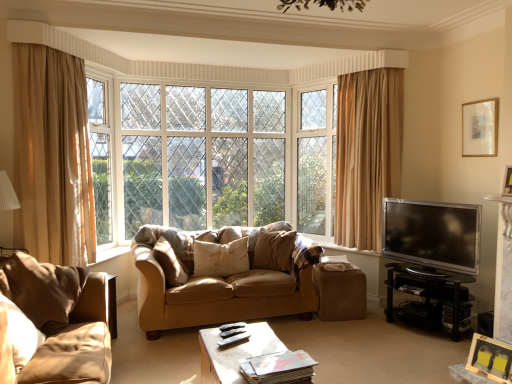
Question: Considering the relative positions of beige fabric pillow at center, the 2th pillow viewed from the left, and suede-like beige pillow at center, which appears as the 3th pillow when viewed from the right, in the image provided, is beige fabric pillow at center, the 2th pillow viewed from the left, in front of suede-like beige pillow at center, which appears as the 3th pillow when viewed from the right,?

Choices:
 (A) no
 (B) yes

Answer: (A)

Question: Does beige fabric pillow at center, the 2th pillow viewed from the left, have a lesser height compared to suede-like beige pillow at center, which appears as the 3th pillow when viewed from the right?

Choices:
 (A) yes
 (B) no

Answer: (A)

Question: Can you confirm if beige fabric pillow at center, the 2th pillow viewed from the left, is smaller than suede-like beige pillow at center, the first pillow viewed from the left?

Choices:
 (A) no
 (B) yes

Answer: (B)

Question: From a real-world perspective, is beige fabric pillow at center, the 2th pillow viewed from the left, on top of suede-like beige pillow at center, the first pillow viewed from the left?

Choices:
 (A) no
 (B) yes

Answer: (A)

Question: Is beige fabric pillow at center, the 2th pillow from the right, oriented towards suede-like beige pillow at center, the first pillow viewed from the left?

Choices:
 (A) yes
 (B) no

Answer: (B)

Question: From the image's perspective, is beige fabric pillow at center, the 2th pillow from the right, beneath suede-like beige pillow at center, the first pillow viewed from the left?

Choices:
 (A) yes
 (B) no

Answer: (A)

Question: Does white painted wood window frame at upper left lie in front of silver metallic tv at right?

Choices:
 (A) no
 (B) yes

Answer: (A)

Question: Can you confirm if white painted wood window frame at upper left is smaller than silver metallic tv at right?

Choices:
 (A) no
 (B) yes

Answer: (A)

Question: Is white painted wood window frame at upper left oriented towards silver metallic tv at right?

Choices:
 (A) yes
 (B) no

Answer: (A)

Question: Does white painted wood window frame at upper left appear on the right side of silver metallic tv at right?

Choices:
 (A) no
 (B) yes

Answer: (A)

Question: From a real-world perspective, is white painted wood window frame at upper left physically above silver metallic tv at right?

Choices:
 (A) yes
 (B) no

Answer: (A)

Question: Can you confirm if white painted wood window frame at upper left is shorter than silver metallic tv at right?

Choices:
 (A) no
 (B) yes

Answer: (A)

Question: Could you tell me if wooden picture frame at lower right, which ranks as the third picture frame in right-to-left order, is facing white painted wood window frame at upper left?

Choices:
 (A) no
 (B) yes

Answer: (A)